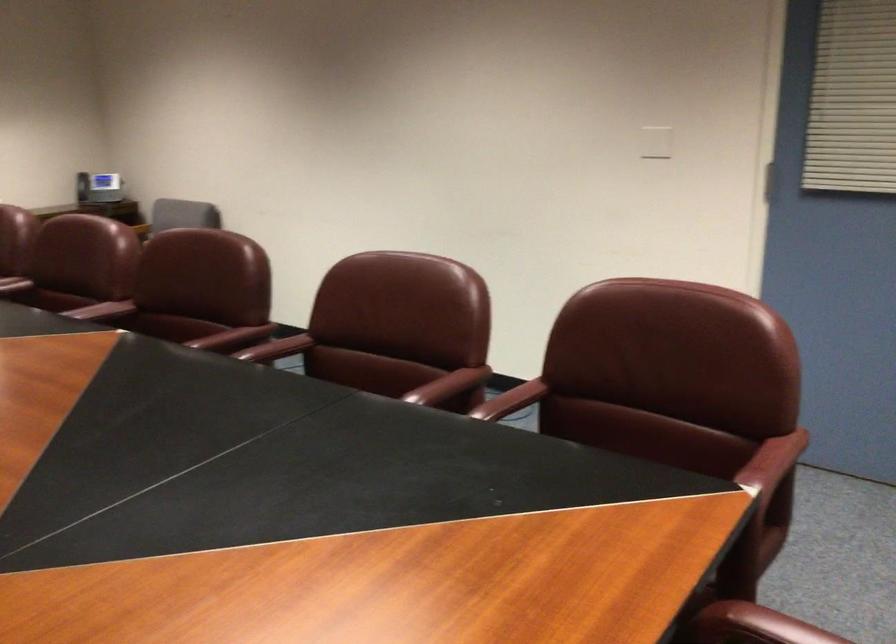
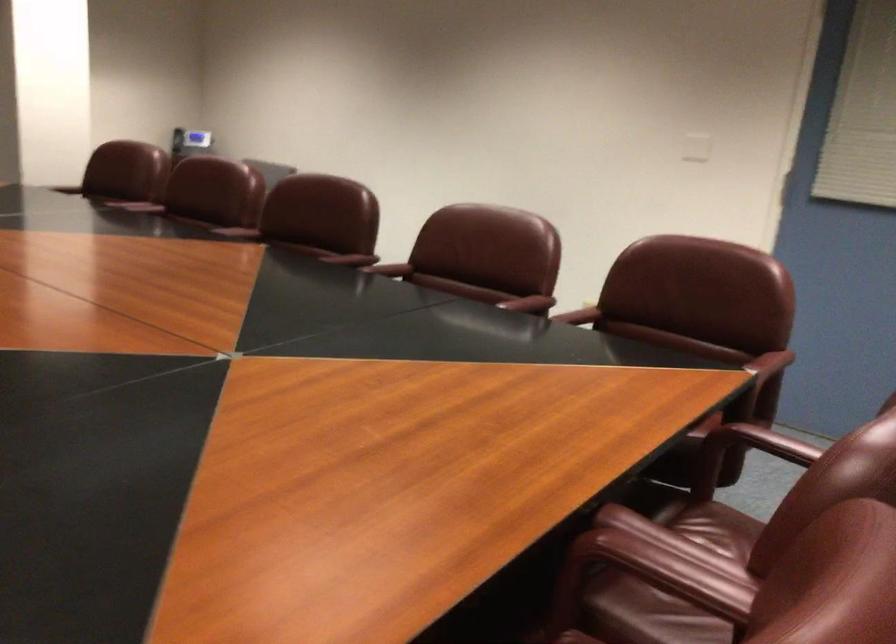
In the second image, find the point that corresponds to (x=279, y=348) in the first image.

(390, 269)